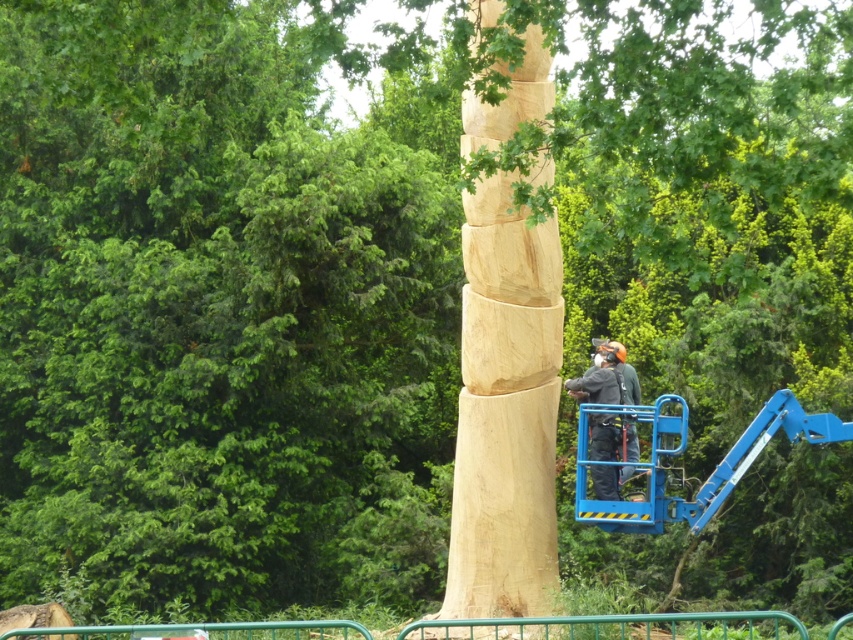
Can you confirm if natural wood tree trunk at center is wider than wooden helmet at center?

Incorrect, natural wood tree trunk at center's width does not surpass wooden helmet at center's.

Can you confirm if natural wood tree trunk at center is positioned above wooden helmet at center?

Yes, natural wood tree trunk at center is above wooden helmet at center.

Where is `natural wood tree trunk at center`? This screenshot has height=640, width=853. natural wood tree trunk at center is located at coordinates (505, 410).